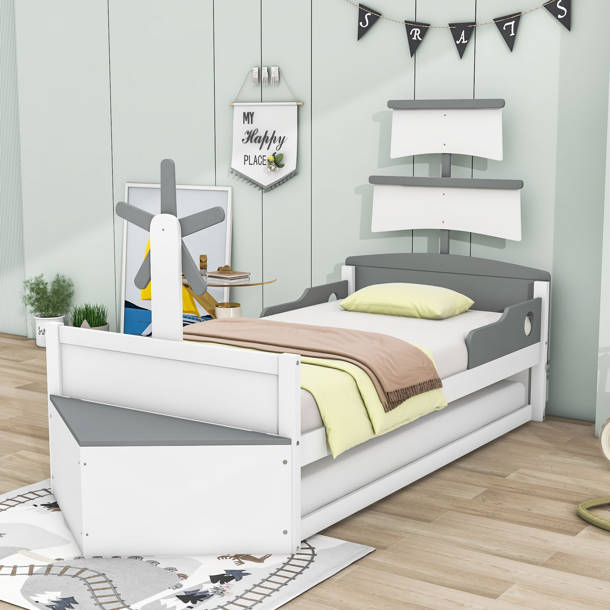
In order to click on rug in this screenshot , I will do `click(146, 575)`.